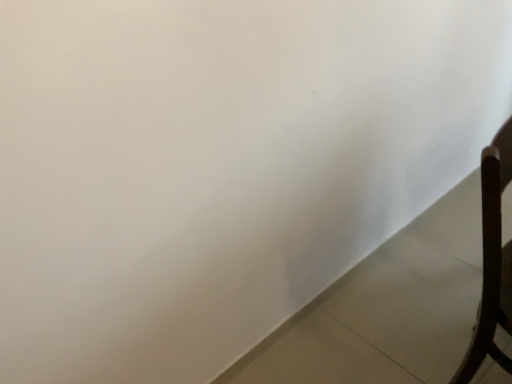
Where is `dark wood chair at right`? Image resolution: width=512 pixels, height=384 pixels. dark wood chair at right is located at coordinates (492, 261).

What is the approximate height of dark wood chair at right?

dark wood chair at right is 31.66 inches tall.

Describe the element at coordinates (492, 261) in the screenshot. I see `dark wood chair at right` at that location.

Image resolution: width=512 pixels, height=384 pixels. I want to click on dark wood chair at right, so click(x=492, y=261).